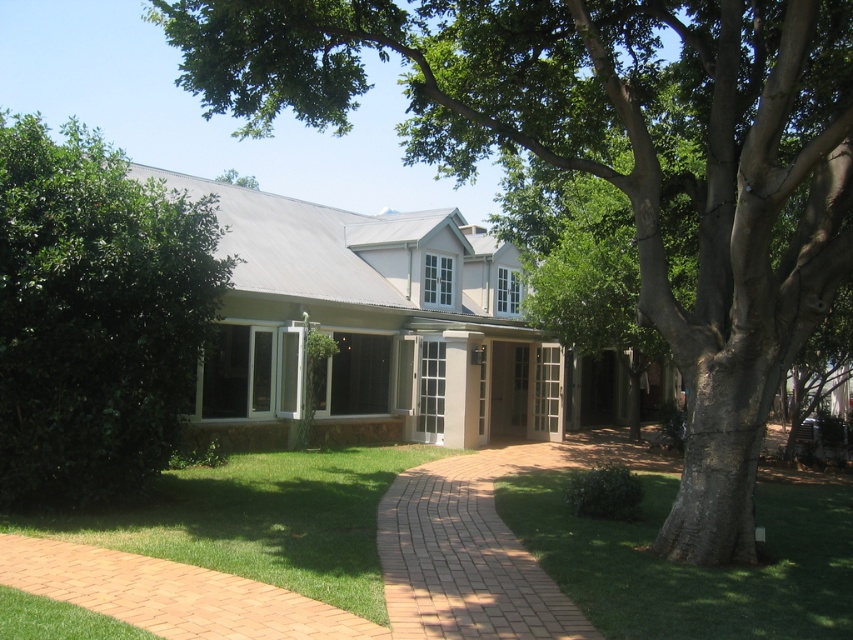
You are standing at the entrance of the house and want to walk to the green grass at lower right. Which direction should you turn to face the brick at center before proceeding?

You should turn to your left to face the brick at center, as the green grass at lower right is located to the right of the brick at center.